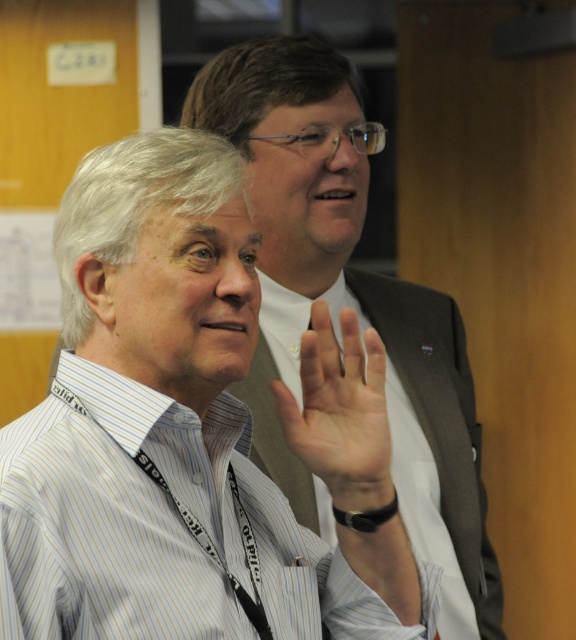
Can you confirm if white striped dress shirt at center is positioned to the left of gray fabric business suit at center?

Yes, white striped dress shirt at center is to the left of gray fabric business suit at center.

Is white striped dress shirt at center further to camera compared to gray fabric business suit at center?

No, white striped dress shirt at center is closer to the viewer.

Which is behind, point (223, 636) or point (458, 353)?

The point (458, 353) is behind.

Locate an element on the screen. Image resolution: width=576 pixels, height=640 pixels. white striped dress shirt at center is located at coordinates (161, 525).

Does white striped dress shirt at center have a larger size compared to pale skin palm at center?

Yes.

Who is shorter, white striped dress shirt at center or pale skin palm at center?

pale skin palm at center is shorter.

The image size is (576, 640). What do you see at coordinates (161, 525) in the screenshot? I see `white striped dress shirt at center` at bounding box center [161, 525].

This screenshot has width=576, height=640. Identify the location of white striped dress shirt at center. (161, 525).

Is gray fabric business suit at center thinner than pale skin palm at center?

Incorrect, gray fabric business suit at center's width is not less than pale skin palm at center's.

Between point (430, 356) and point (350, 342), which one is positioned in front?

Positioned in front is point (350, 342).

Image resolution: width=576 pixels, height=640 pixels. What are the coordinates of `gray fabric business suit at center` in the screenshot? It's located at (441, 419).